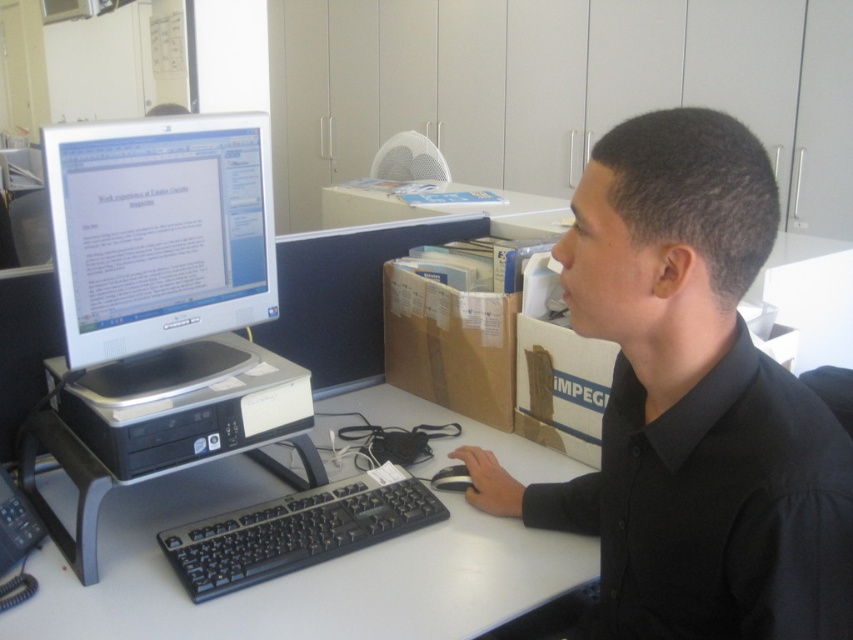
You are setting up a new desk arrangement and want to place a small plant between the white glossy monitor at center and the black rubber mouse at center. Since the monitor is taller than the mouse, where should you position the plant to ensure it is visible from both the top and bottom of the desk?

The white glossy monitor at center is taller than the black rubber mouse at center, so positioning the plant closer to the base of the monitor would ensure visibility from both the top and bottom areas of the desk.

You are a photographer taking a picture of the workspace. You notice the black matte shirt at center and the black matte keyboard at center. Which object appears bigger in the photo?

The black matte shirt at center appears bigger in the photo because it has a larger size compared to the black matte keyboard at center.

You are an office worker who just arrived at your desk. You notice a black matte shirt at center and a black plastic computer desk at center. Which object is positioned to the right side from your perspective?

The black matte shirt at center is positioned to the right of the black plastic computer desk at center.